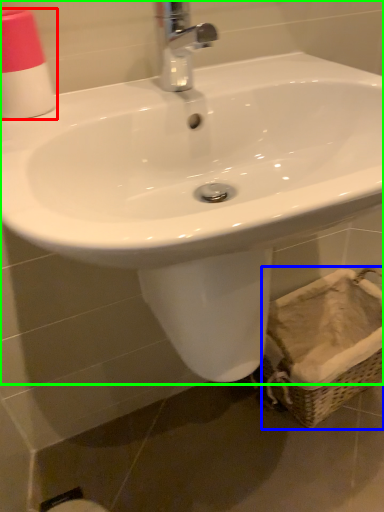
Question: Which is farther away from toiletry (highlighted by a red box)? basket (highlighted by a blue box) or sink (highlighted by a green box)?

Choices:
 (A) basket
 (B) sink

Answer: (A)